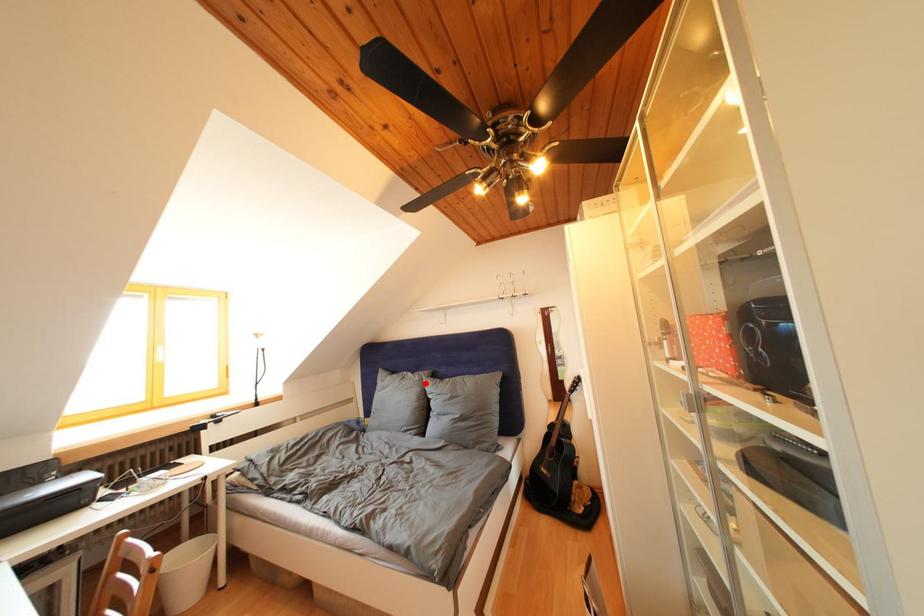
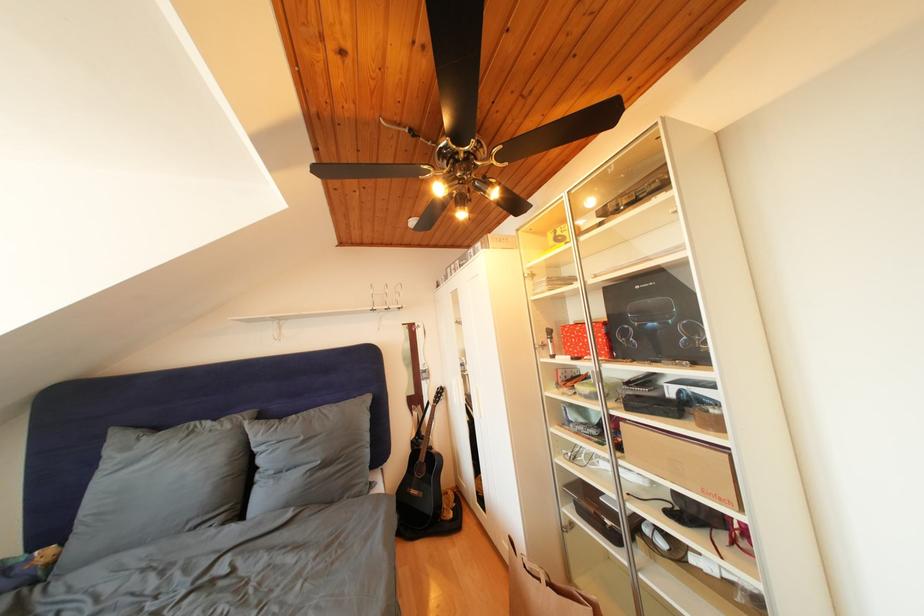
In the second image, find the point that corresponds to the highlighted location in the first image.

(236, 432)